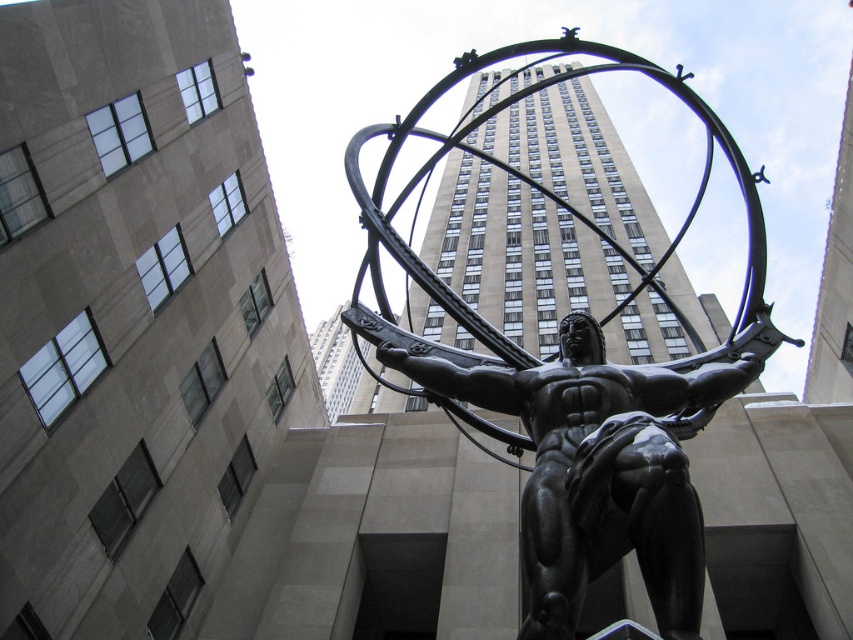
Question: Does bronze statue at center appear on the left side of black polished statue at center?

Choices:
 (A) no
 (B) yes

Answer: (A)

Question: Which point is farther to the camera?

Choices:
 (A) bronze statue at center
 (B) black polished statue at center

Answer: (A)

Question: Is bronze statue at center below black polished statue at center?

Choices:
 (A) no
 (B) yes

Answer: (A)

Question: Observing the image, what is the correct spatial positioning of bronze statue at center in reference to black polished statue at center?

Choices:
 (A) below
 (B) above

Answer: (B)